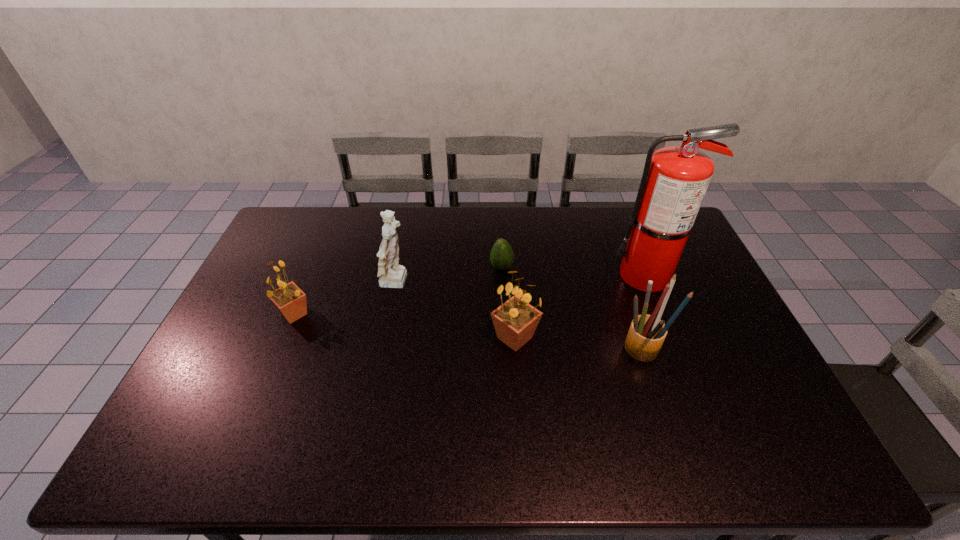
Locate an element on the screen. The width and height of the screenshot is (960, 540). vacant space positioned 0.090m at the front of the right sunflower with flowers visible is located at coordinates (518, 386).

At what (x,y) coordinates should I click in order to perform the action: click on blank space located 0.250m on the front-facing side of the figurine. Please return your answer as a coordinate pair (x, y). Image resolution: width=960 pixels, height=540 pixels. Looking at the image, I should click on (492, 284).

In order to click on vacant space located 0.250m on the back of the shortest object in this screenshot , I will do `click(499, 218)`.

Locate an element on the screen. free space located 0.050m at the nozzle of the tallest object is located at coordinates (595, 275).

You are a GUI agent. You are given a task and a screenshot of the screen. Output one action in this format:
    pyautogui.click(x=<x>, y=<y>)
    Task: Click on the free space located at the nozzle of the tallest object
    
    Given the screenshot: What is the action you would take?
    pyautogui.click(x=523, y=275)

Find the location of `free space located 0.070m at the nozzle of the tallest object`. free space located 0.070m at the nozzle of the tallest object is located at coordinates (589, 275).

The width and height of the screenshot is (960, 540). Find the location of `free point located 0.130m on the back of the pencil box`. free point located 0.130m on the back of the pencil box is located at coordinates (627, 298).

Where is `object that is positioned at the left edge`? The width and height of the screenshot is (960, 540). object that is positioned at the left edge is located at coordinates (289, 299).

Identify the location of object situated at the right edge. The width and height of the screenshot is (960, 540). (675, 179).

Where is `free space at the far edge of the desktop`? Image resolution: width=960 pixels, height=540 pixels. free space at the far edge of the desktop is located at coordinates (578, 220).